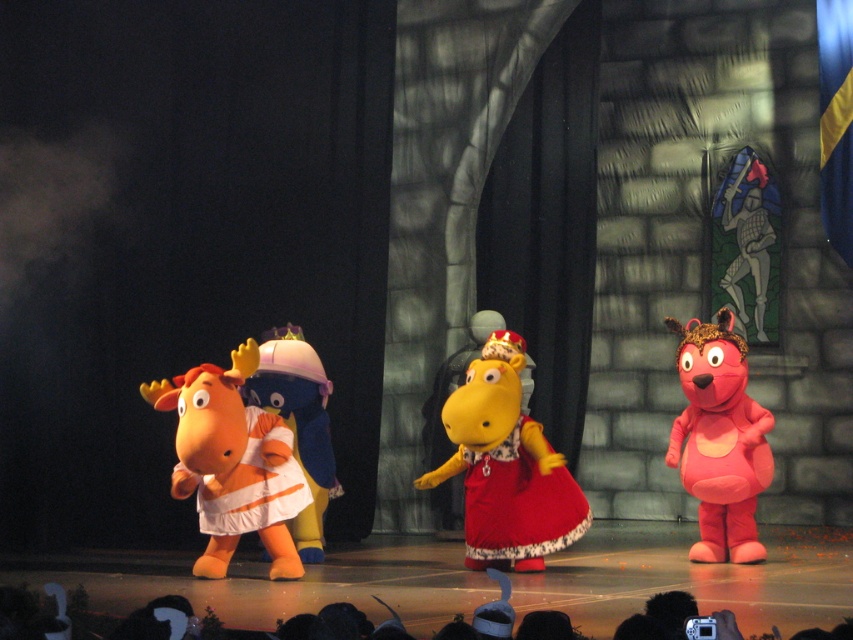
Question: Does yellow plush hippo at center have a larger size compared to white fabric duckling at center?

Choices:
 (A) no
 (B) yes

Answer: (B)

Question: Among these points, which one is nearest to the camera?

Choices:
 (A) (276, 432)
 (B) (511, 502)

Answer: (A)

Question: Considering the relative positions of orange plush moose at left and pink plush dog at right in the image provided, where is orange plush moose at left located with respect to pink plush dog at right?

Choices:
 (A) below
 (B) above

Answer: (A)

Question: Among these objects, which one is farthest from the camera?

Choices:
 (A) pink plush dog at right
 (B) matte red dress at center
 (C) yellow plush hippo at center

Answer: (A)

Question: Which point is farther to the camera?

Choices:
 (A) pink plush dog at right
 (B) yellow plush hippo at center

Answer: (A)

Question: Is yellow plush hippo at center positioned at the back of orange fabric dress at center?

Choices:
 (A) no
 (B) yes

Answer: (B)